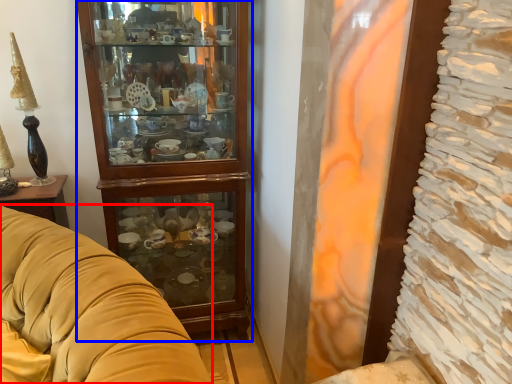
Question: Which point is closer to the camera, studio couch (highlighted by a red box) or cabinetry (highlighted by a blue box)?

Choices:
 (A) studio couch
 (B) cabinetry

Answer: (A)